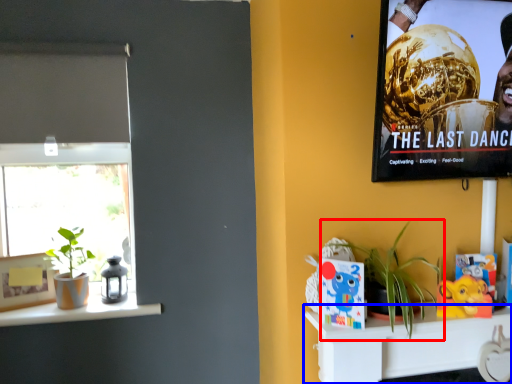
Question: Which of the following is the farthest to the observer, houseplant (highlighted by a red box) or shelf (highlighted by a blue box)?

Choices:
 (A) houseplant
 (B) shelf

Answer: (B)